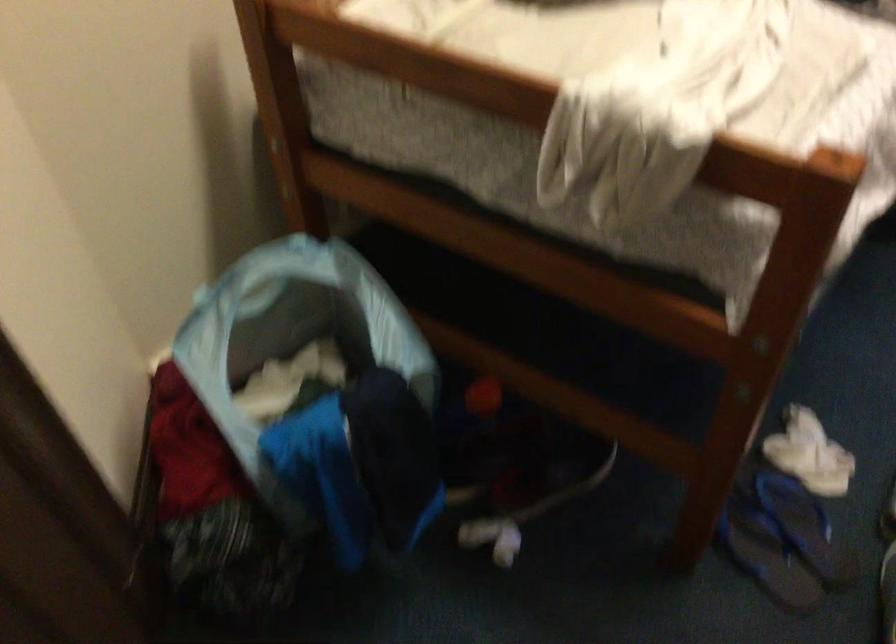
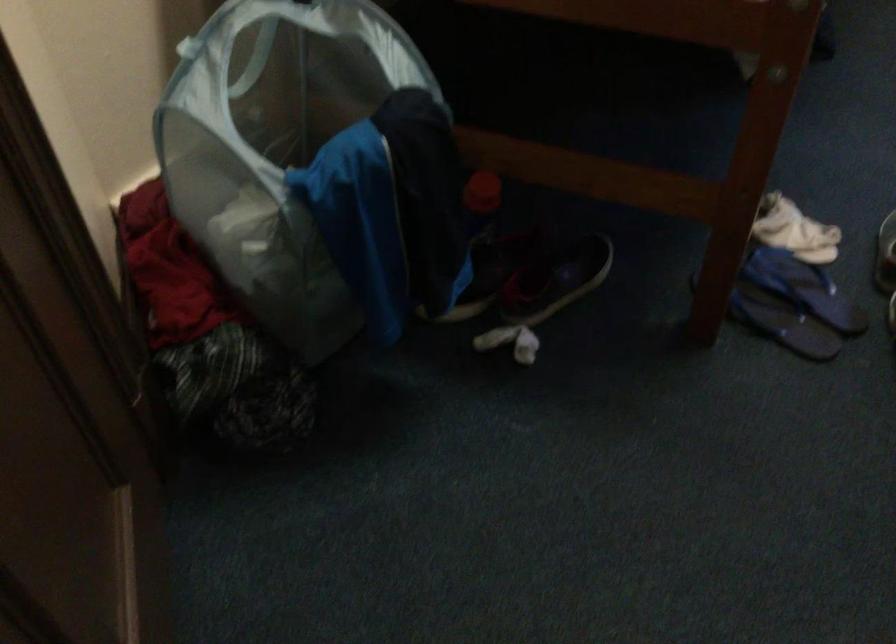
In a continuous first-person perspective shot, in which direction is the camera moving?

The cameraman moved toward left, forward.